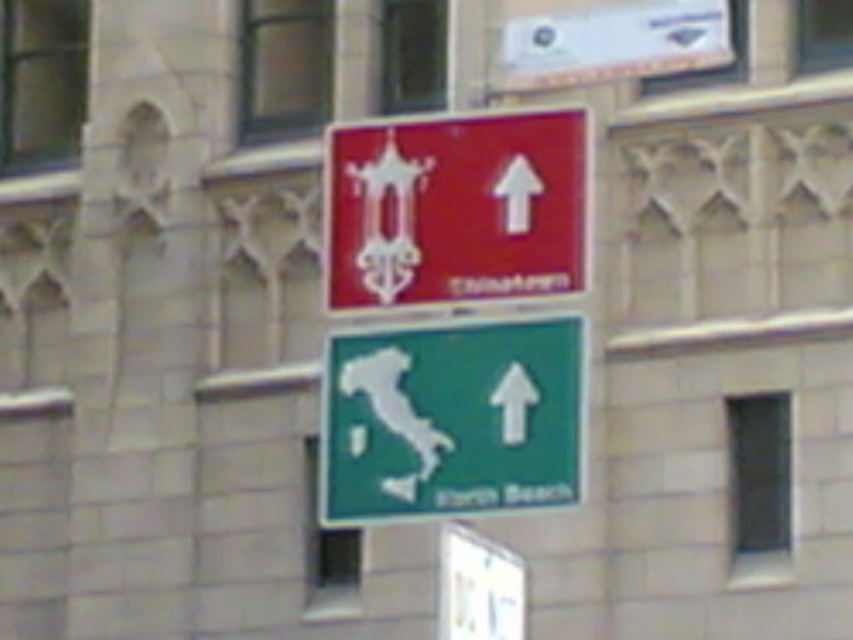
You are standing at the base of the pole with the two road signs and want to place a green matte map at center between them. Can you fit it there without overlapping either sign?

The two road signs are 38.28 meters apart, so yes, the green matte map at center can be placed between them without overlapping since there is sufficient space.

You are a tourist trying to find the Italian consulate in this area. You see a green matte map at center and a matte red sign at center. Which one is located above the other?

The matte red sign at center is above the green matte map at center because the green matte map at center is below the matte red sign at center.

You are a tourist holding a map and looking at the two road signs on the pole. You need to choose between the green matte map at center and the matte red sign at center for directions. Which one is narrower so it fits better in your pocket?

The green matte map at center is thinner than the matte red sign at center, so it will fit better in your pocket.